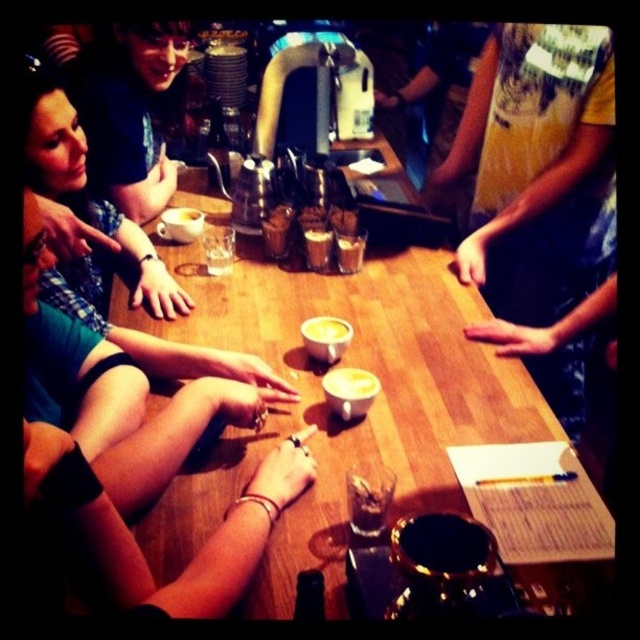
You are a waiter in a dimly lit cafe. You need to place a new order of a hot chocolate on the table without disturbing the matte black arm at lower left. Where should you place it?

The matte black arm at lower left is located at coordinates point (134,540). To avoid disturbing it, place the hot chocolate away from that position.

You are a barista who needs to place a new cup of coffee on the table without it being taller than the existing tallest item. The table has the white frothy beverage at center and the translucent glass at center. Which item should you use as a reference for the maximum height?

The white frothy beverage at center is taller than the translucent glass at center, so you should use the white frothy beverage at center as the reference for the maximum height to ensure the new cup of coffee does not exceed it.

You are standing in the dining area and want to reach the point marked at coordinates (193, 563). Considering the distance from your current position, can you estimate whether you need to take more than one step to reach it?

The point at coordinates (193, 563) is 32.07 inches away from the camera. Since an average step is about 30 inches, you would need to take more than one step to reach it.